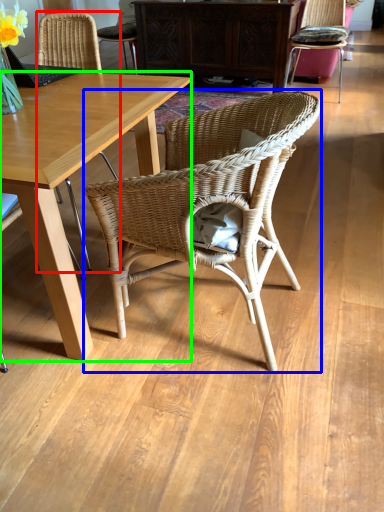
Question: Which is nearer to the chair (highlighted by a red box)? chair (highlighted by a blue box) or desk (highlighted by a green box).

Choices:
 (A) chair
 (B) desk

Answer: (B)